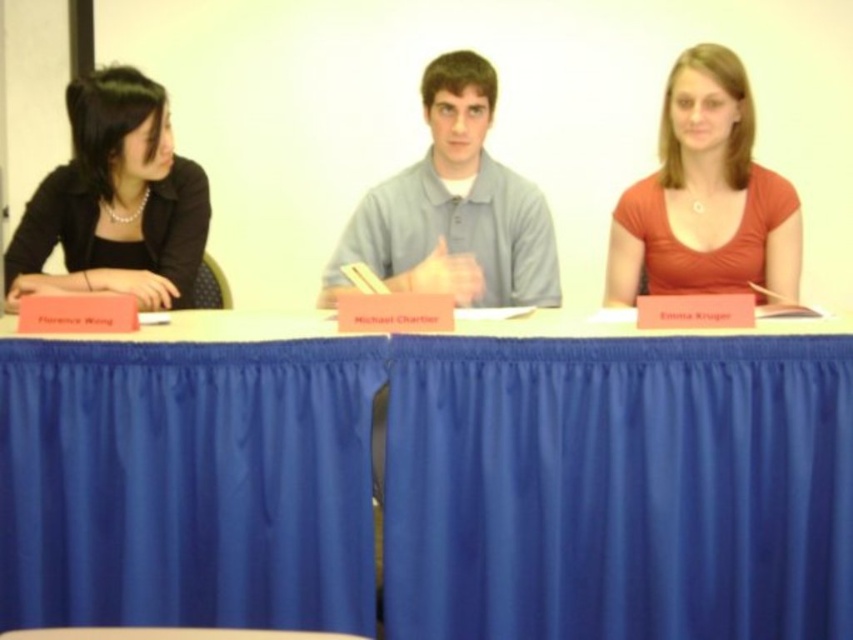
You are standing in front of the blue fabric table at center and want to place a 1.5 meter long document on it. Will the document fit on the table?

The blue fabric table at center is 1.64 meters from viewer, so the document will fit as it is shorter than the table length.

You are standing in front of the long table with three people. There are two points marked on the table surface. The first point is at coordinate (509, 365) and the second is at (491, 88). If you want to place a small object on the table so that it is closer to you, which point should you choose?

Result: You should choose point (509, 365) because it is closer to the viewer than point (491, 88).

You are standing at the point with coordinates point [695,227] and want to move to the point with coordinates point [527,301]. Which direction should you move in relation to the table?

You should move towards the direction of the table since point [527,301] is behind point [695,227].